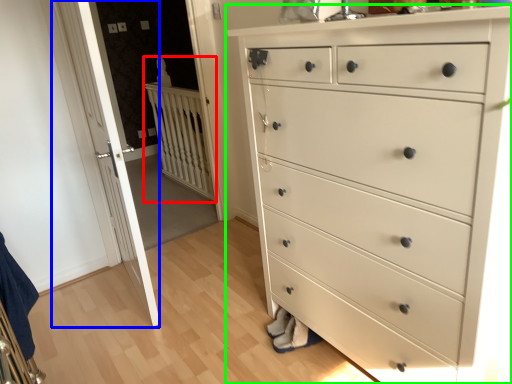
Question: Which is farther away from balustrade (highlighted by a red box)? door (highlighted by a blue box) or chest of drawers (highlighted by a green box)?

Choices:
 (A) door
 (B) chest of drawers

Answer: (B)